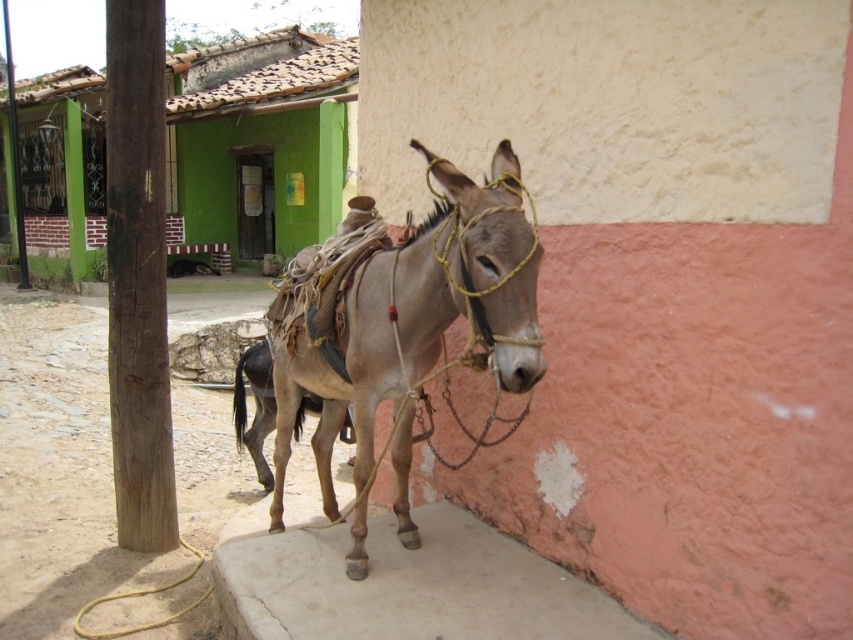
Question: Which of the following is the closest to the observer?

Choices:
 (A) grayish-brown leather mule at center
 (B) light brown leather donkey at center

Answer: (B)

Question: Which object is farther from the camera taking this photo?

Choices:
 (A) grayish-brown leather mule at center
 (B) light brown leather donkey at center

Answer: (A)

Question: Is light brown leather donkey at center bigger than grayish-brown leather mule at center?

Choices:
 (A) yes
 (B) no

Answer: (A)

Question: Does light brown leather donkey at center have a smaller size compared to grayish-brown leather mule at center?

Choices:
 (A) yes
 (B) no

Answer: (B)

Question: Considering the relative positions of light brown leather donkey at center and grayish-brown leather mule at center in the image provided, where is light brown leather donkey at center located with respect to grayish-brown leather mule at center?

Choices:
 (A) below
 (B) above

Answer: (B)